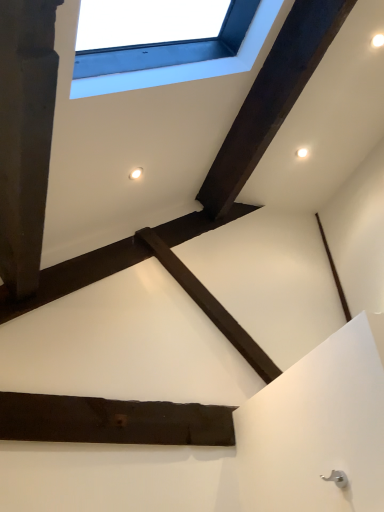
Question: From the image's perspective, is dark brown wood at upper center, the second plank ordered from the bottom, positioned above or below dark wood plank at center, which is the 1th plank from left to right?

Choices:
 (A) above
 (B) below

Answer: (A)

Question: Considering the positions of dark brown wood at upper center, the second plank ordered from the bottom, and dark wood plank at center, placed as the 2th plank when sorted from top to bottom, in the image, is dark brown wood at upper center, the second plank ordered from the bottom, bigger or smaller than dark wood plank at center, placed as the 2th plank when sorted from top to bottom,?

Choices:
 (A) big
 (B) small

Answer: (A)

Question: Based on their relative distances, which object is nearer to the white plastic window at upper center?

Choices:
 (A) dark wood plank at center, placed as the 2th plank when sorted from top to bottom
 (B) dark brown wood at upper center, the second plank from the left

Answer: (B)

Question: Estimate the real-world distances between objects in this image. Which object is closer to the dark brown wood at upper center, the second plank ordered from the bottom?

Choices:
 (A) dark wood plank at center, which is counted as the second plank, starting from the right
 (B) white plastic window at upper center

Answer: (B)